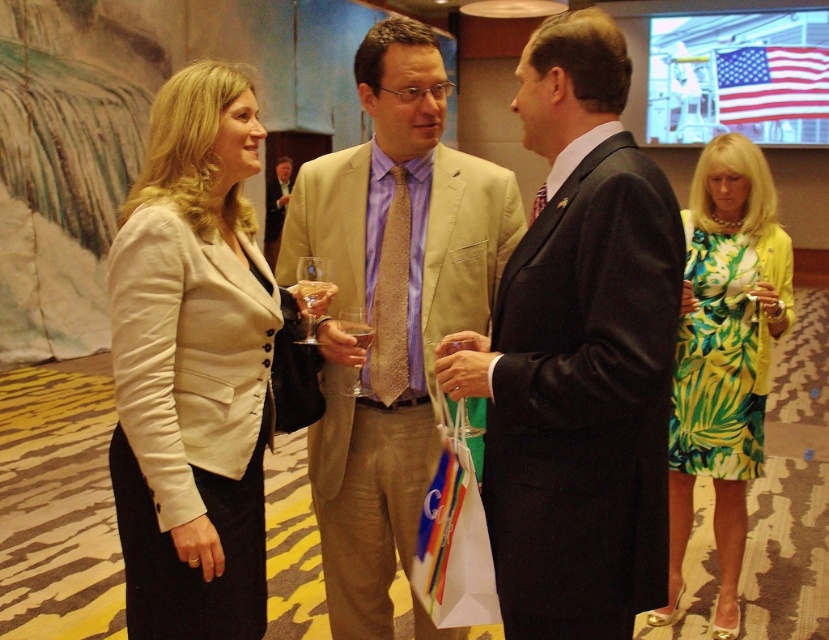
Is point (699, 452) farther from viewer compared to point (360, 369)?

That is True.

In the scene shown: Can you confirm if green leafy dress at right is taller than translucent glass wine glass at center?

Indeed, green leafy dress at right has a greater height compared to translucent glass wine glass at center.

Measure the distance between green leafy dress at right and camera.

A distance of 8.05 feet exists between green leafy dress at right and camera.

At what (x,y) coordinates should I click in order to perform the action: click on green leafy dress at right. Please return your answer as a coordinate pair (x, y). The width and height of the screenshot is (829, 640). Looking at the image, I should click on (725, 356).

Can you confirm if dark suit at center is wider than green leafy dress at right?

In fact, dark suit at center might be narrower than green leafy dress at right.

Is dark suit at center to the right of green leafy dress at right from the viewer's perspective?

No, dark suit at center is not to the right of green leafy dress at right.

Which is behind, point (606, 266) or point (728, 416)?

The point (728, 416) is behind.

At what (x,y) coordinates should I click in order to perform the action: click on dark suit at center. Please return your answer as a coordinate pair (x, y). This screenshot has height=640, width=829. Looking at the image, I should click on (578, 355).

What do you see at coordinates (725, 356) in the screenshot?
I see `green leafy dress at right` at bounding box center [725, 356].

You are a GUI agent. You are given a task and a screenshot of the screen. Output one action in this format:
    pyautogui.click(x=<x>, y=<y>)
    Task: Click on the green leafy dress at right
    This screenshot has height=640, width=829.
    Given the screenshot: What is the action you would take?
    pyautogui.click(x=725, y=356)

Locate an element on the screen. The height and width of the screenshot is (640, 829). green leafy dress at right is located at coordinates (725, 356).